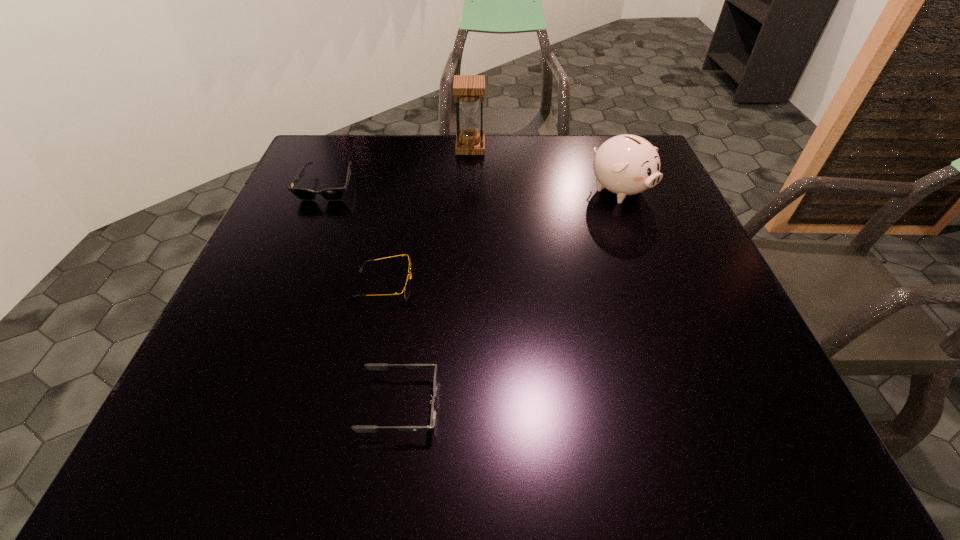
Locate an element on the screen. Image resolution: width=960 pixels, height=540 pixels. blank region between the nearest object and the rightmost object is located at coordinates (510, 298).

Locate an element on the screen. The height and width of the screenshot is (540, 960). vacant area that lies between the rightmost object and the hourglass is located at coordinates (544, 169).

The height and width of the screenshot is (540, 960). In order to click on free space between the nearest object and the second nearest sunglasses in this screenshot , I will do `click(393, 345)`.

Identify the location of unoccupied position between the fourth farthest object and the rightmost object. (502, 238).

The width and height of the screenshot is (960, 540). I want to click on object that ranks as the third closest to the tallest object, so click(407, 287).

The image size is (960, 540). Identify the location of the fourth closest object relative to the farthest object. (371, 366).

Identify which sunglasses is located as the second nearest to the second nearest object. Please provide its 2D coordinates. Your answer should be formatted as a tuple, i.e. [(x, y)], where the tuple contains the x and y coordinates of a point satisfying the conditions above.

[(332, 194)]

This screenshot has width=960, height=540. Find the location of `sunglasses that can be found as the closest to the farthest sunglasses`. sunglasses that can be found as the closest to the farthest sunglasses is located at coordinates (407, 287).

I want to click on vacant area that satisfies the following two spatial constraints: 1. on the front side of the farthest object; 2. on the temples of the nearest object, so click(x=463, y=405).

The image size is (960, 540). What are the coordinates of `free spot that satisfies the following two spatial constraints: 1. on the front side of the farthest object; 2. on the front-facing side of the second nearest object` in the screenshot? It's located at (467, 285).